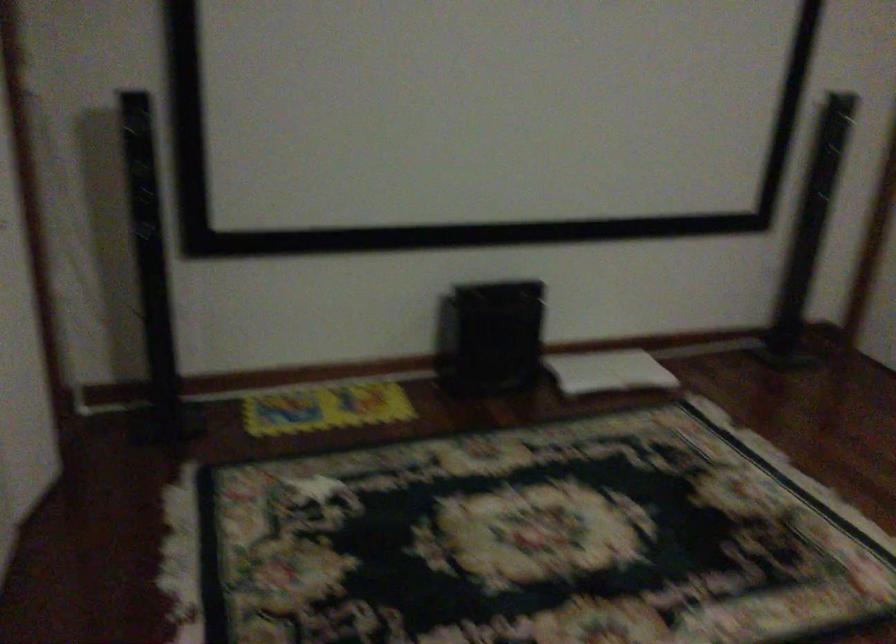
Identify the location of small black box. (489, 337).